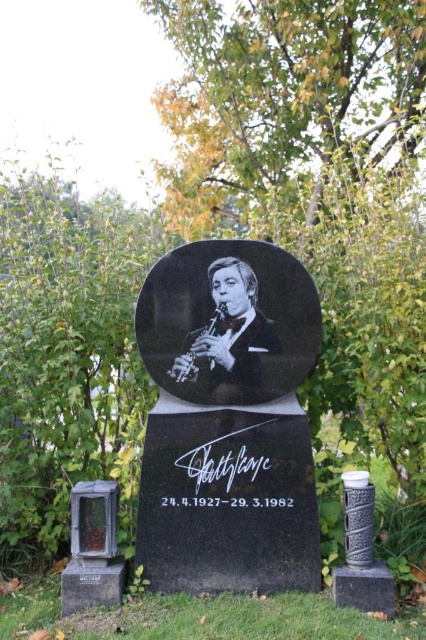
You are standing 10 feet away from the gravestone. A point at coordinates point [239,316] is marked on the gravestone. Is this point closer to you than the edge of the gravestone?

The distance of point [239,316] from viewer is 12.20 feet. Since you are standing 10 feet away from the gravestone, the point is 2.20 feet farther than your current position. Therefore, the point is not closer to you than the edge of the gravestone.

From the picture: You are a historian examining the gravestone and notice two items at the center. Which one is taller between the black polished stone plaque at center and the black glossy portrait at center?

The black polished stone plaque at center is taller than the black glossy portrait at center.